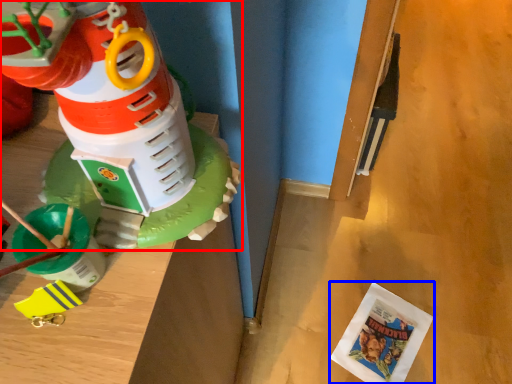
Question: Which point is closer to the camera, toy (highlighted by a red box) or comic book (highlighted by a blue box)?

Choices:
 (A) toy
 (B) comic book

Answer: (A)